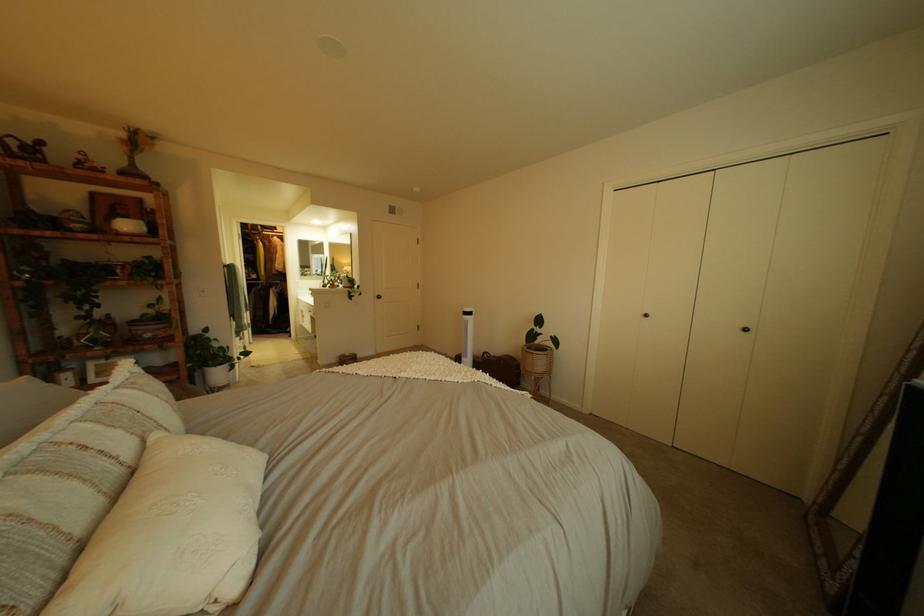
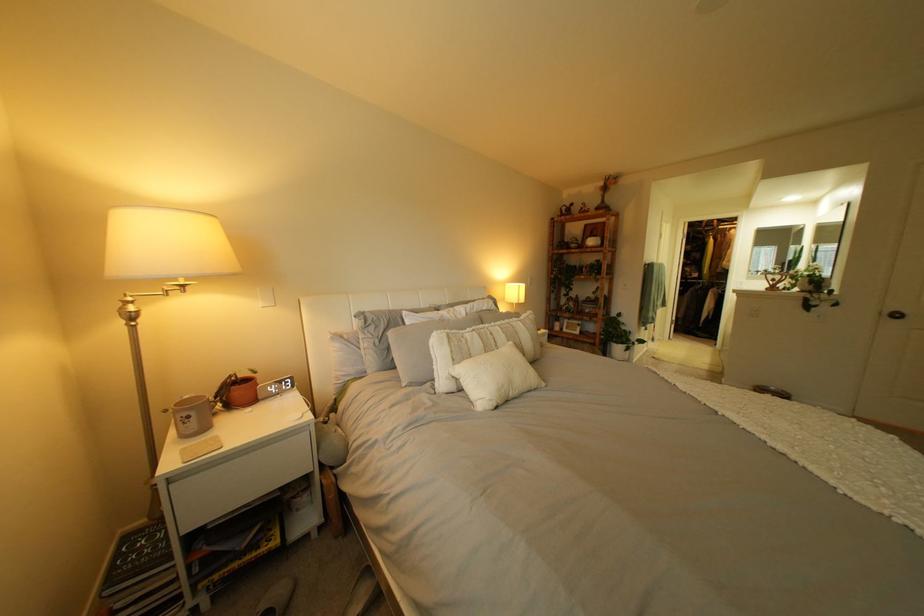
Where in the second image is the point corresponding to [392,297] from the first image?

(903, 313)